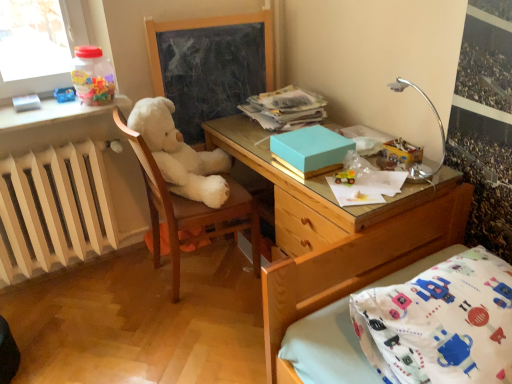
Identify the location of vacant area on the back side of yellow rubber toy car at center, which appears as the 1th toy when viewed from the front. (344, 167).